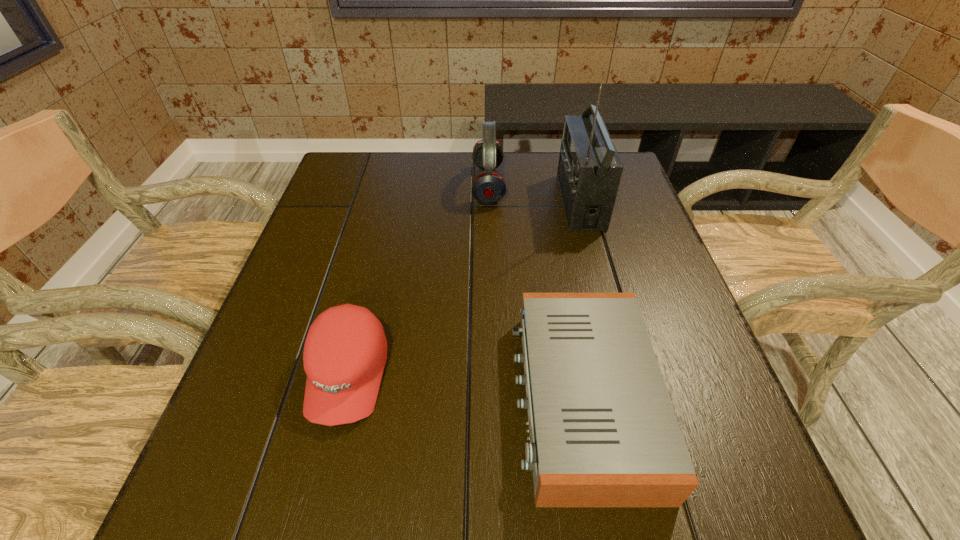
This screenshot has height=540, width=960. I want to click on free point that satisfies the following two spatial constraints: 1. on the ear cups of the earphone; 2. on the front-facing side of the leftmost object, so click(492, 375).

This screenshot has width=960, height=540. In order to click on vacant space that satisfies the following two spatial constraints: 1. on the front panel of the tallest object; 2. on the front-facing side of the third tallest object in this screenshot , I will do `click(627, 375)`.

This screenshot has width=960, height=540. In order to click on free spot that satisfies the following two spatial constraints: 1. on the front panel of the farther radio receiver; 2. on the front-facing side of the cap in this screenshot , I will do `click(627, 375)`.

Find the location of a particular element. free space that satisfies the following two spatial constraints: 1. on the ear cups of the earphone; 2. on the front-facing side of the leftmost object is located at coordinates (492, 375).

The width and height of the screenshot is (960, 540). Identify the location of free spot that satisfies the following two spatial constraints: 1. on the front panel of the tallest object; 2. on the front-facing side of the third tallest object. (627, 375).

What are the coordinates of `blank area in the image that satisfies the following two spatial constraints: 1. on the front panel of the farther radio receiver; 2. on the front-facing side of the third tallest object` in the screenshot? It's located at [x=627, y=375].